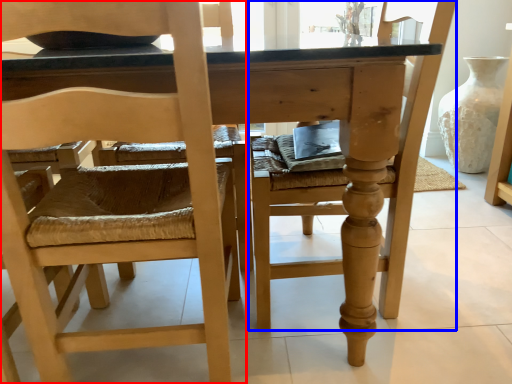
Question: Which object is further to the camera taking this photo, chair (highlighted by a red box) or chair (highlighted by a blue box)?

Choices:
 (A) chair
 (B) chair

Answer: (B)